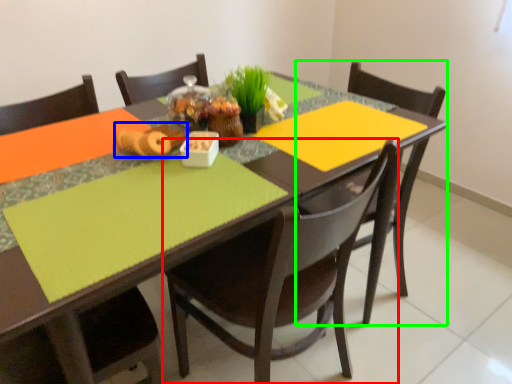
Question: Considering the real-world distances, which object is farthest from chair (highlighted by a red box)? food (highlighted by a blue box) or chair (highlighted by a green box)?

Choices:
 (A) food
 (B) chair

Answer: (A)